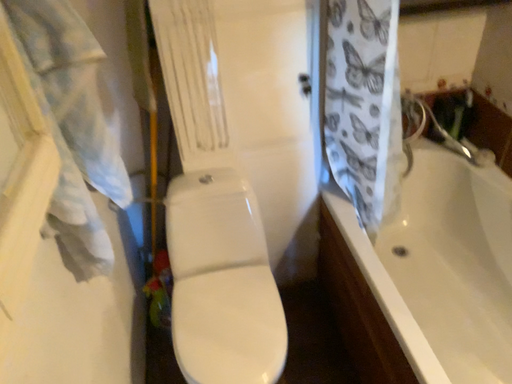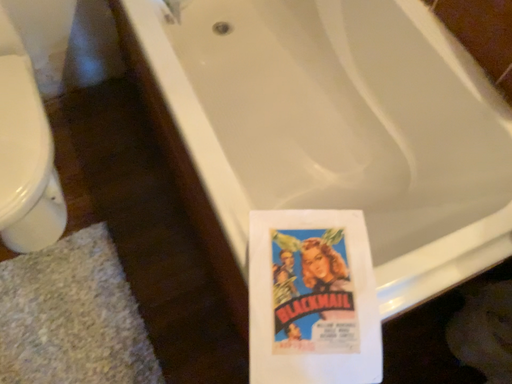
Question: How did the camera likely rotate when shooting the video?

Choices:
 (A) rotated left
 (B) rotated right

Answer: (B)